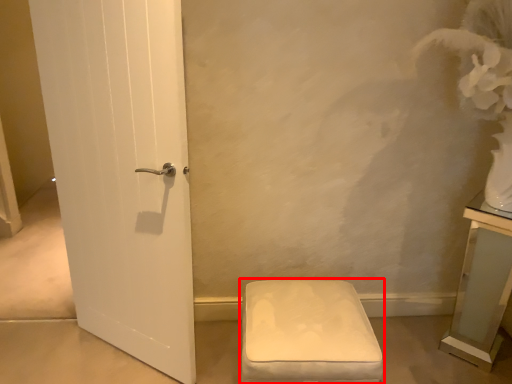
Question: From the image's perspective, considering the relative positions of furniture (annotated by the red box) and vanity in the image provided, where is furniture (annotated by the red box) located with respect to the staircase?

Choices:
 (A) below
 (B) above

Answer: (A)